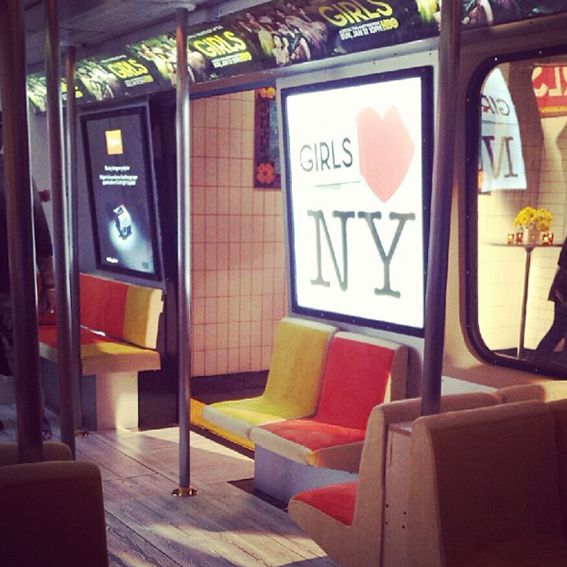
Locate an element on the screen. This screenshot has width=567, height=567. light is located at coordinates (260, 556).